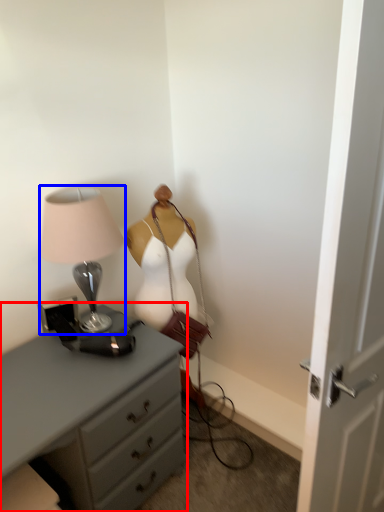
Question: Which of the following is the closest to the observer, chest of drawers (highlighted by a red box) or lamp (highlighted by a blue box)?

Choices:
 (A) chest of drawers
 (B) lamp

Answer: (A)